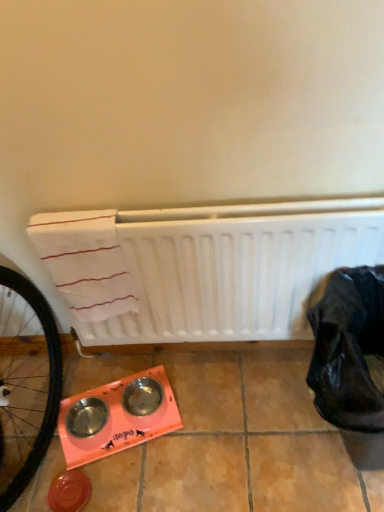
Locate an element on the screen. vacant area that is in front of white matte radiator at center is located at coordinates (220, 429).